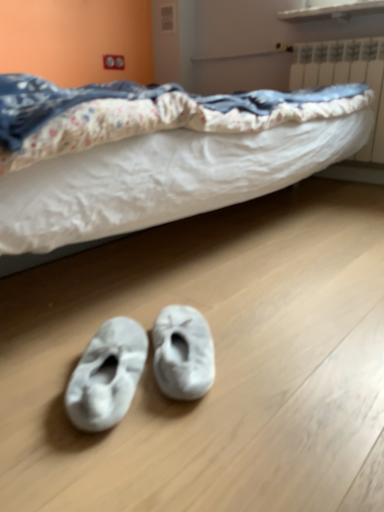
Image resolution: width=384 pixels, height=512 pixels. In order to click on vacant area that lies to the right of white fuzzy slippers at lower center, the 1th footwear viewed from the right in this screenshot , I will do `click(272, 359)`.